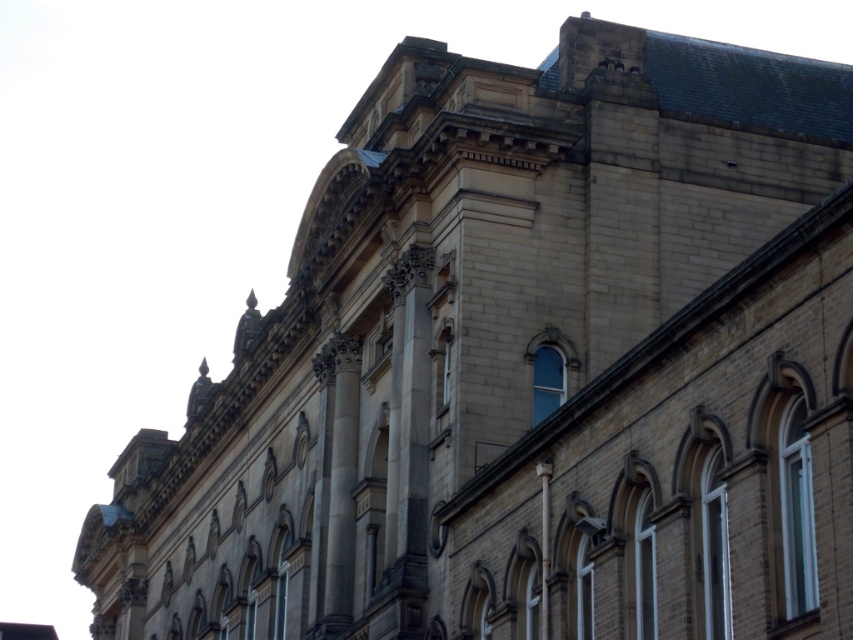
Question: In this image, where is brown brick window at center-right located relative to clear glass window at center?

Choices:
 (A) above
 (B) below

Answer: (B)

Question: Which point appears closest to the camera in this image?

Choices:
 (A) (770, 355)
 (B) (799, 461)
 (C) (440, 326)

Answer: (A)

Question: Is white plastic window at right to the left of clear glass window at upper center from the viewer's perspective?

Choices:
 (A) no
 (B) yes

Answer: (A)

Question: Among these objects, which one is farthest from the camera?

Choices:
 (A) white plastic window at right
 (B) brown brick window at center-right
 (C) clear glass window at center
 (D) clear glass window at upper center

Answer: (C)

Question: Which is nearer to the clear glass window at upper center?

Choices:
 (A) clear glass window at center
 (B) white plastic window at right

Answer: (A)

Question: Does clear glass window at upper center have a larger size compared to clear glass window at center?

Choices:
 (A) no
 (B) yes

Answer: (B)